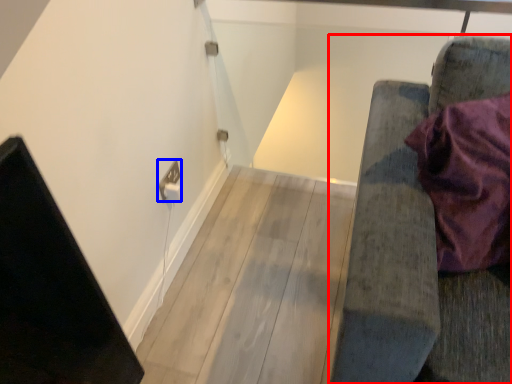
Question: Which object is further to the camera taking this photo, furniture (highlighted by a red box) or electric outlet (highlighted by a blue box)?

Choices:
 (A) furniture
 (B) electric outlet

Answer: (B)